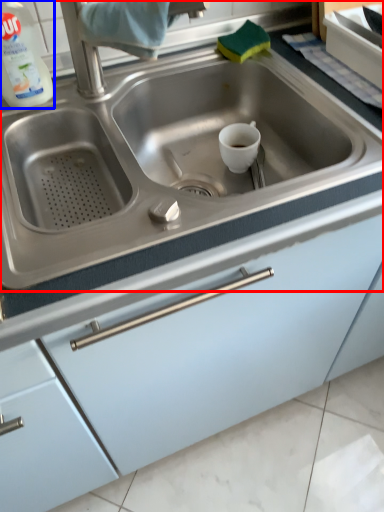
Question: Which object appears farthest to the camera in this image, sink (highlighted by a red box) or cleaning product (highlighted by a blue box)?

Choices:
 (A) sink
 (B) cleaning product

Answer: (B)